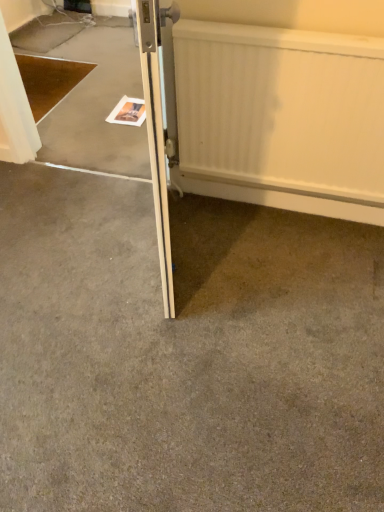
Locate an element on the screen. This screenshot has height=512, width=384. wooden door at center is located at coordinates (156, 135).

What are the coordinates of `wooden door at center` in the screenshot? It's located at (156, 135).

From the image's perspective, is white textured radiator at upper right positioned above or below wooden door at center?

white textured radiator at upper right is above wooden door at center.

From a real-world perspective, is white textured radiator at upper right positioned above or below wooden door at center?

white textured radiator at upper right is situated lower than wooden door at center in the real world.

I want to click on radiator on the right of the wooden door at center, so click(282, 117).

Is white textured radiator at upper right placed right next to wooden door at center?

No, white textured radiator at upper right is not next to wooden door at center.

Does white textured radiator at upper right turn towards gray carpet at center?

No.

Which of these two, white textured radiator at upper right or gray carpet at center, is wider?

Wider between the two is gray carpet at center.

Based on the photo, considering the relative positions of white textured radiator at upper right and gray carpet at center in the image provided, is white textured radiator at upper right to the left or to the right of gray carpet at center?

Based on their positions, white textured radiator at upper right is located to the right of gray carpet at center.

Are white textured radiator at upper right and gray carpet at center far apart?

No, white textured radiator at upper right is not far away from gray carpet at center.

In terms of width, does wooden door at center look wider or thinner when compared to gray carpet at center?

wooden door at center is thinner than gray carpet at center.

Identify the location of door that appears on the right of gray carpet at center. (156, 135).

Is wooden door at center in contact with gray carpet at center?

There is a gap between wooden door at center and gray carpet at center.

Does wooden door at center come in front of gray carpet at center?

Yes, wooden door at center is closer to the camera.

From a real-world perspective, which is physically below, wooden door at center or white textured radiator at upper right?

In real-world perspective, white textured radiator at upper right is lower.

Considering the relative sizes of wooden door at center and white textured radiator at upper right in the image provided, is wooden door at center bigger than white textured radiator at upper right?

Indeed, wooden door at center has a larger size compared to white textured radiator at upper right.

Is wooden door at center inside the boundaries of white textured radiator at upper right, or outside?

wooden door at center cannot be found inside white textured radiator at upper right.

Which object is positioned more to the right, wooden door at center or white textured radiator at upper right?

Positioned to the right is white textured radiator at upper right.

Does gray carpet at center have a greater height compared to wooden door at center?

No.

Would you say gray carpet at center is inside or outside wooden door at center?

gray carpet at center is spatially situated outside wooden door at center.

Which is behind, point (371, 339) or point (167, 16)?

The point (371, 339) is behind.

Between gray carpet at center and wooden door at center, which one has smaller width?

Thinner between the two is wooden door at center.

Between point (332, 253) and point (302, 190), which one is positioned in front?

The point (332, 253) is in front.

From the image's perspective, which object appears higher, gray carpet at center or white textured radiator at upper right?

white textured radiator at upper right, from the image's perspective.

From a real-world perspective, who is located lower, gray carpet at center or white textured radiator at upper right?

gray carpet at center.

You are a GUI agent. You are given a task and a screenshot of the screen. Output one action in this format:
    pyautogui.click(x=<x>, y=<y>)
    Task: Click on the door that is in front of the white textured radiator at upper right
    The image size is (384, 512).
    Given the screenshot: What is the action you would take?
    pyautogui.click(x=156, y=135)

In the image, there is a white textured radiator at upper right. What are the coordinates of `concrete below it (from a real-world perspective)` in the screenshot? It's located at (184, 356).

Estimate the real-world distances between objects in this image. Which object is further from wooden door at center, gray carpet at center or white textured radiator at upper right?

Based on the image, gray carpet at center appears to be further to wooden door at center.

When comparing their distances from gray carpet at center, does white textured radiator at upper right or wooden door at center seem further?

white textured radiator at upper right lies further to gray carpet at center than the other object.

Looking at the image, which one is located closer to gray carpet at center, wooden door at center or white textured radiator at upper right?

wooden door at center is closer to gray carpet at center.

When comparing their distances from wooden door at center, does white textured radiator at upper right or gray carpet at center seem further?

gray carpet at center lies further to wooden door at center than the other object.

From the image, which object appears to be nearer to white textured radiator at upper right, wooden door at center or gray carpet at center?

wooden door at center.

From the image, which object appears to be nearer to white textured radiator at upper right, gray carpet at center or wooden door at center?

Based on the image, wooden door at center appears to be nearer to white textured radiator at upper right.

Find the location of a particular element. The image size is (384, 512). door between white textured radiator at upper right and gray carpet at center in the vertical direction is located at coordinates (156, 135).